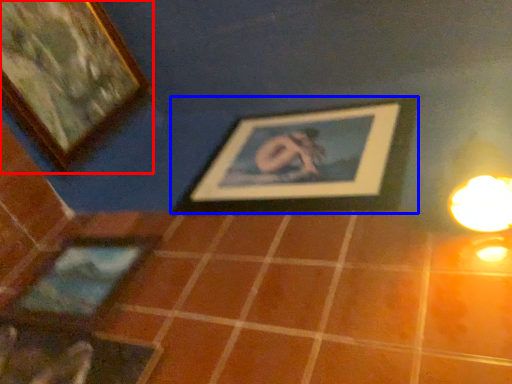
Question: Which of the following is the closest to the observer, picture frame (highlighted by a red box) or picture frame (highlighted by a blue box)?

Choices:
 (A) picture frame
 (B) picture frame

Answer: (B)